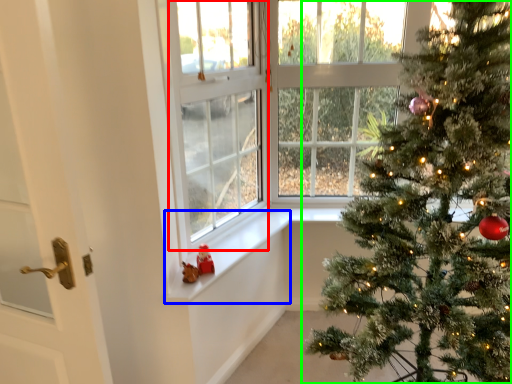
Question: Considering the real-world distances, which object is farthest from window screen (highlighted by a red box)? window sill (highlighted by a blue box) or christmas tree (highlighted by a green box)?

Choices:
 (A) window sill
 (B) christmas tree

Answer: (B)